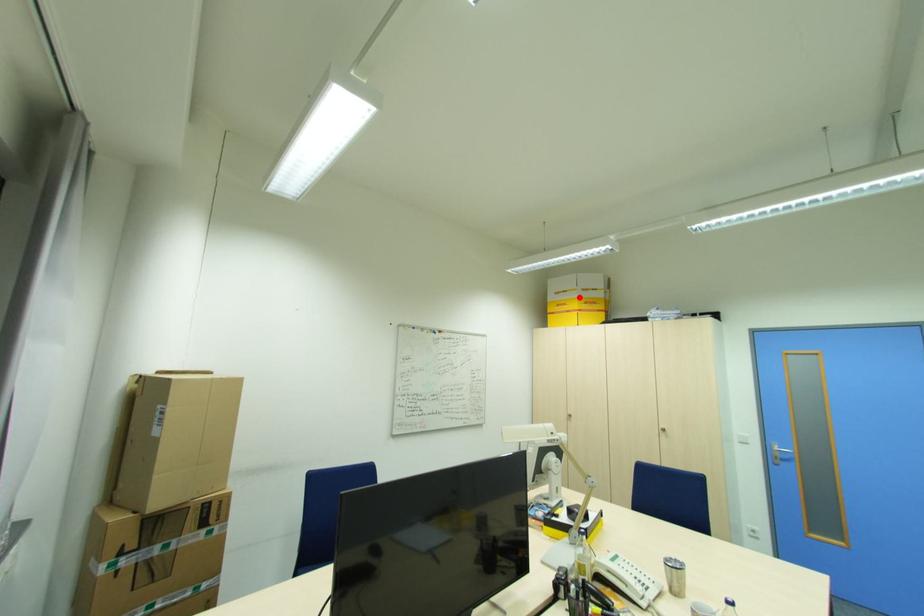
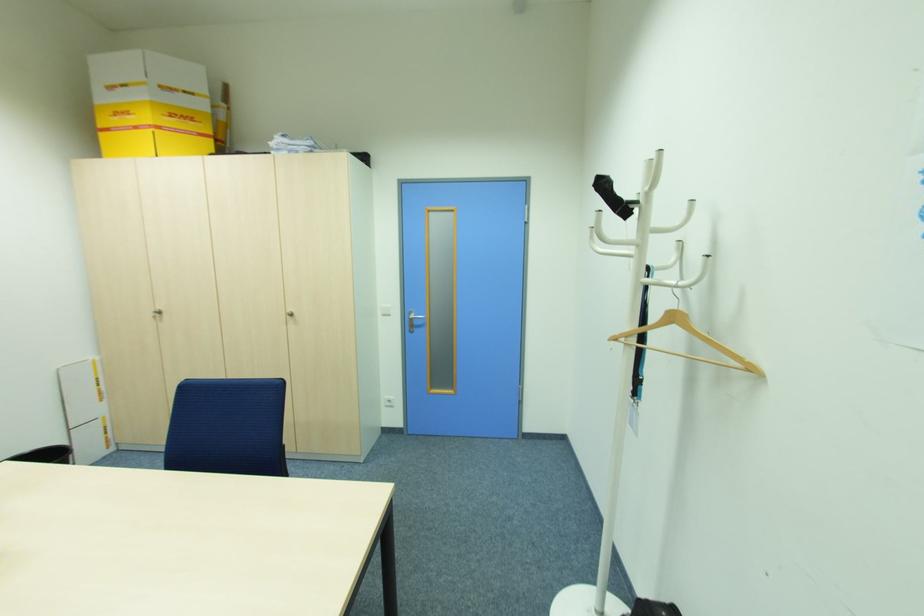
In the second image, find the point that corresponds to the highlighted location in the first image.

(147, 95)